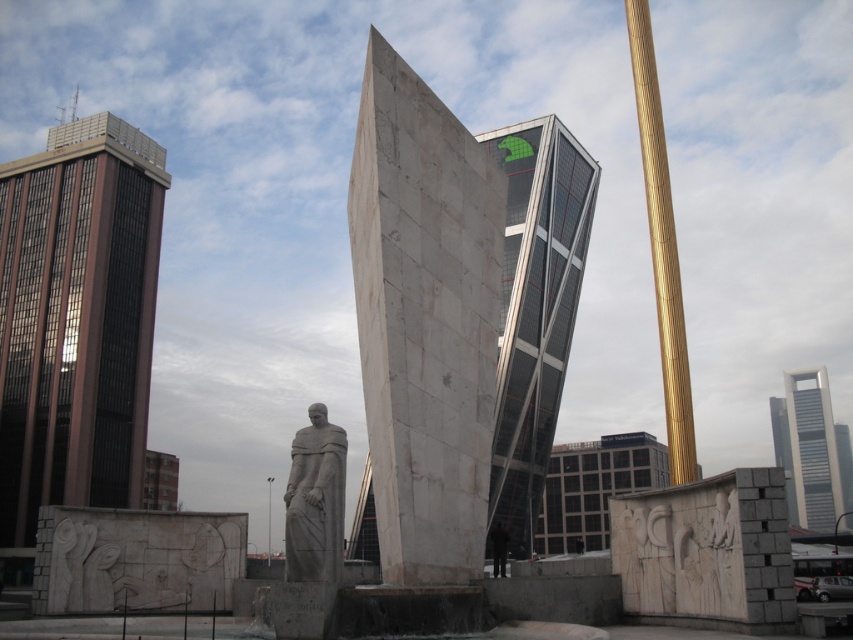
Question: Can you confirm if glassy steel skyscraper at center is bigger than gold polished pole at upper right?

Choices:
 (A) no
 (B) yes

Answer: (B)

Question: Which object appears farthest from the camera in this image?

Choices:
 (A) gray stone statue at center
 (B) glassy steel skyscraper at center
 (C) dark gray concrete building at center
 (D) smooth gray skyscraper at upper right

Answer: (D)

Question: Can you confirm if dark gray concrete building at center is positioned below gray stone statue at center?

Choices:
 (A) no
 (B) yes

Answer: (B)

Question: Considering the relative positions of glassy steel skyscraper at center and smooth gray skyscraper at upper right in the image provided, where is glassy steel skyscraper at center located with respect to smooth gray skyscraper at upper right?

Choices:
 (A) below
 (B) above

Answer: (B)

Question: Which object appears farthest from the camera in this image?

Choices:
 (A) brown glass building at left
 (B) gray stone statue at center
 (C) glassy steel skyscraper at center

Answer: (A)

Question: Among these points, which one is farthest from the camera?

Choices:
 (A) (39, 458)
 (B) (503, 129)

Answer: (B)